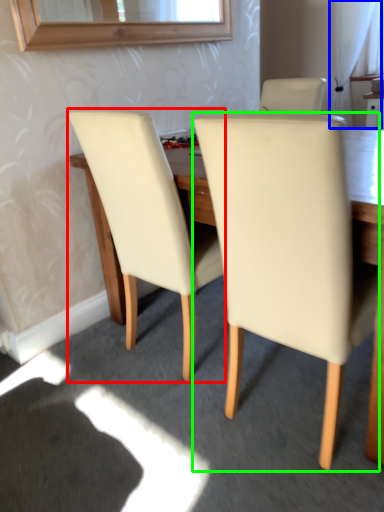
Question: Considering the real-world distances, which object is closest to chair (highlighted by a red box)? curtain (highlighted by a blue box) or chair (highlighted by a green box).

Choices:
 (A) curtain
 (B) chair

Answer: (B)